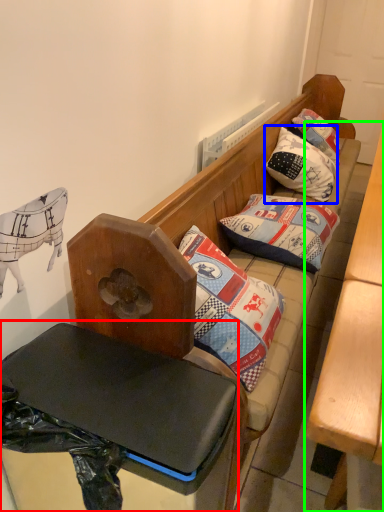
Question: Which is farther away from table (highlighted by a red box)? pillow (highlighted by a blue box) or table (highlighted by a green box)?

Choices:
 (A) pillow
 (B) table

Answer: (A)